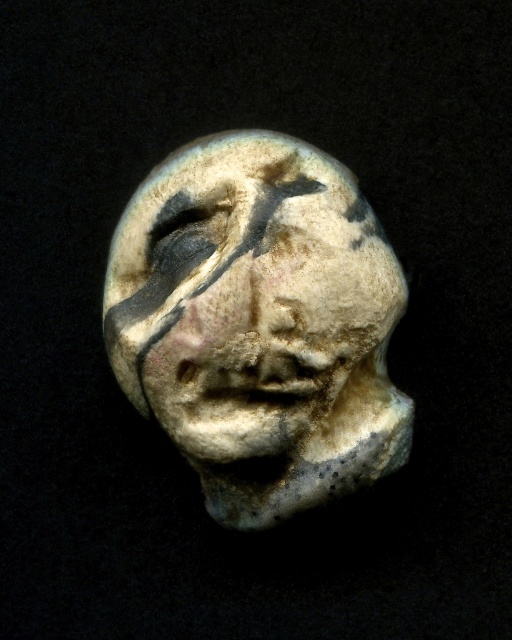
Between speckled clay face at center and matte white skull at center, which one is positioned lower?

Positioned lower is speckled clay face at center.

Is speckled clay face at center thinner than matte white skull at center?

In fact, speckled clay face at center might be wider than matte white skull at center.

Describe the element at coordinates (251, 300) in the screenshot. This screenshot has width=512, height=640. I see `speckled clay face at center` at that location.

Locate an element on the screen. This screenshot has height=640, width=512. speckled clay face at center is located at coordinates (251, 300).